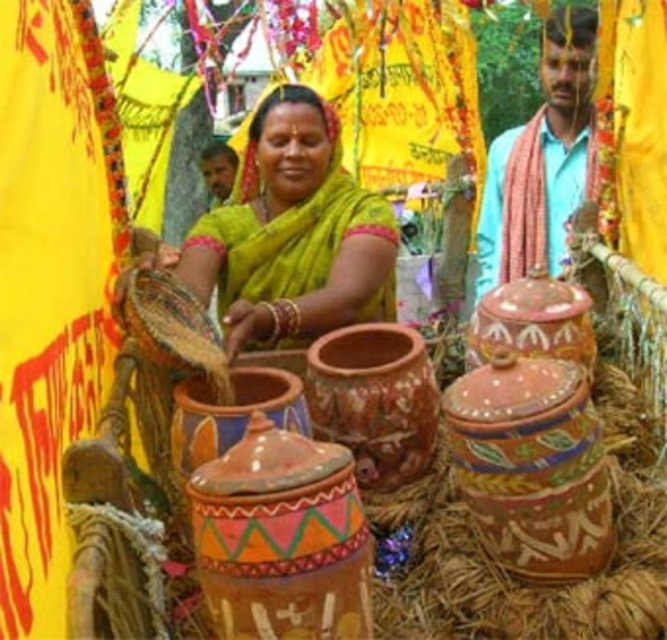
Question: Estimate the real-world distances between objects in this image. Which object is closer to the hand-painted terracotta jar at center?

Choices:
 (A) terracotta pot at center
 (B) multicolored painted jar at center
 (C) terracotta jar at center
 (D) brown wooden head at center

Answer: (A)

Question: Is matte yellow saree at center positioned in front of hand-painted terracotta jar at center?

Choices:
 (A) yes
 (B) no

Answer: (B)

Question: Can you confirm if matte yellow saree at center is positioned to the right of terracotta pot at center?

Choices:
 (A) yes
 (B) no

Answer: (B)

Question: Is matte yellow saree at center to the right of terracotta jar at center from the viewer's perspective?

Choices:
 (A) no
 (B) yes

Answer: (A)

Question: Which object appears farthest from the camera in this image?

Choices:
 (A) multicolored painted jar at center
 (B) brown wooden head at center
 (C) matte yellow saree at center

Answer: (B)

Question: Which object is farther from the camera taking this photo?

Choices:
 (A) light blue cotton shirt at upper right
 (B) matte yellow saree at center

Answer: (A)